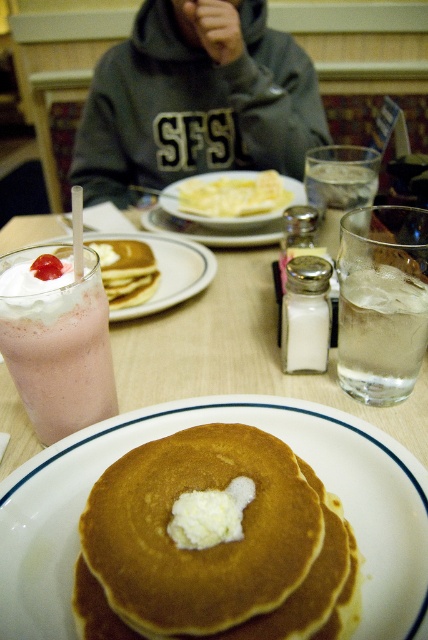
Can you confirm if gray hoodie at upper center is positioned above strawberry milkshake at left?

Yes, gray hoodie at upper center is above strawberry milkshake at left.

Is the position of gray hoodie at upper center less distant than that of strawberry milkshake at left?

No, gray hoodie at upper center is further to the viewer.

This screenshot has width=428, height=640. What do you see at coordinates (196, 100) in the screenshot? I see `gray hoodie at upper center` at bounding box center [196, 100].

The width and height of the screenshot is (428, 640). What are the coordinates of `gray hoodie at upper center` in the screenshot? It's located at (196, 100).

Is point (171, 627) positioned in front of point (368, 317)?

Yes.

Does golden brown pancake at center have a larger size compared to clear glass ice water at right?

Yes, golden brown pancake at center is bigger than clear glass ice water at right.

What do you see at coordinates (202, 548) in the screenshot?
I see `golden brown pancake at center` at bounding box center [202, 548].

Locate an element on the screen. The width and height of the screenshot is (428, 640). golden brown pancake at center is located at coordinates (202, 548).

Does gray hoodie at upper center have a smaller size compared to clear glass ice water at right?

Incorrect, gray hoodie at upper center is not smaller in size than clear glass ice water at right.

Between point (115, 141) and point (419, 332), which one is positioned in front?

Positioned in front is point (419, 332).

Is point (201, 122) positioned in front of point (395, 364)?

No.

The image size is (428, 640). I want to click on gray hoodie at upper center, so click(196, 100).